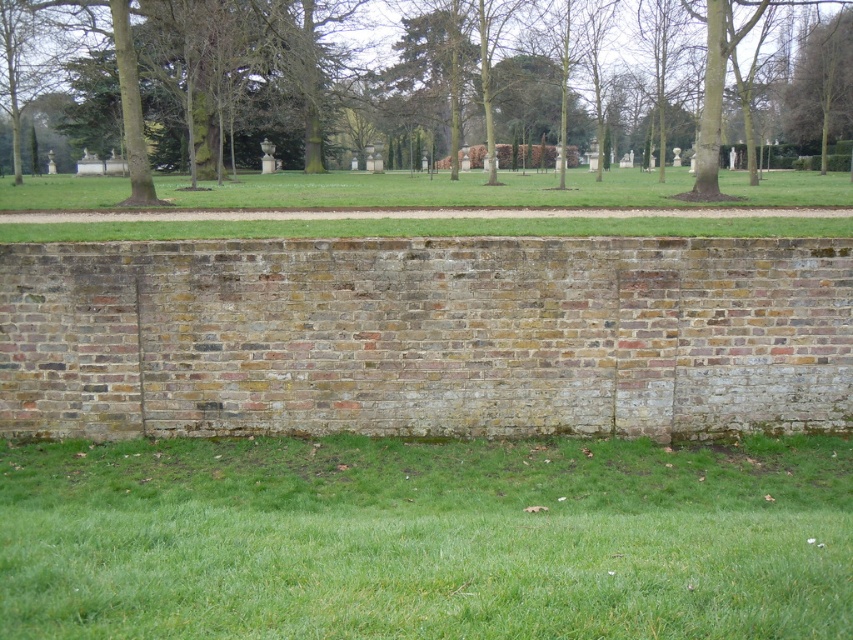
Is green grass at lower center wider than green leafy tree at upper right?

Incorrect, green grass at lower center's width does not surpass green leafy tree at upper right's.

Does green grass at lower center appear on the right side of green leafy tree at upper right?

Incorrect, green grass at lower center is not on the right side of green leafy tree at upper right.

Which is behind, point (247, 461) or point (843, 129)?

Point (843, 129)

You are a GUI agent. You are given a task and a screenshot of the screen. Output one action in this format:
    pyautogui.click(x=<x>, y=<y>)
    Task: Click on the green grass at lower center
    This screenshot has height=640, width=853.
    Given the screenshot: What is the action you would take?
    pyautogui.click(x=425, y=538)

Does green grass at lower center appear under green leafy tree at center?

Indeed, green grass at lower center is positioned under green leafy tree at center.

Can you confirm if green grass at lower center is positioned above green leafy tree at center?

Incorrect, green grass at lower center is not positioned above green leafy tree at center.

Which is behind, point (833, 464) or point (531, 108)?

Point (531, 108)

Where is `green grass at lower center`? This screenshot has width=853, height=640. green grass at lower center is located at coordinates (425, 538).

Which is behind, point (253, 157) or point (840, 72)?

The point (253, 157) is more distant.

Does point (224, 134) lie in front of point (799, 104)?

Yes, point (224, 134) is closer to viewer.

Who is more distant from viewer, (369,140) or (796,61)?

The point (369,140) is behind.

Image resolution: width=853 pixels, height=640 pixels. Find the location of `green leafy tree at center`. green leafy tree at center is located at coordinates (482, 90).